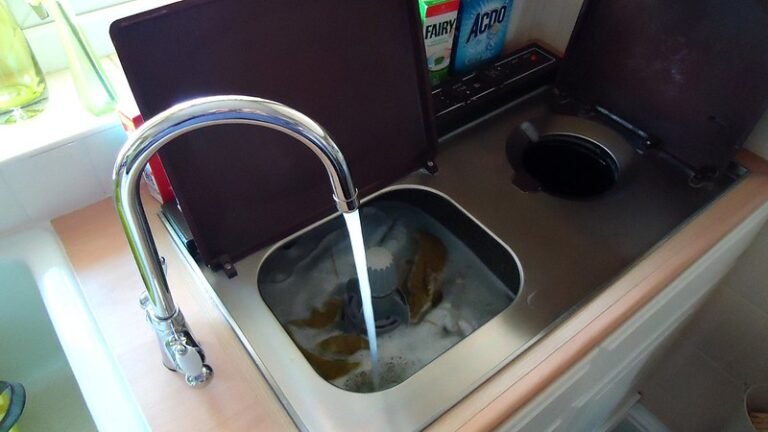
Identify the location of faucet. (220, 117).